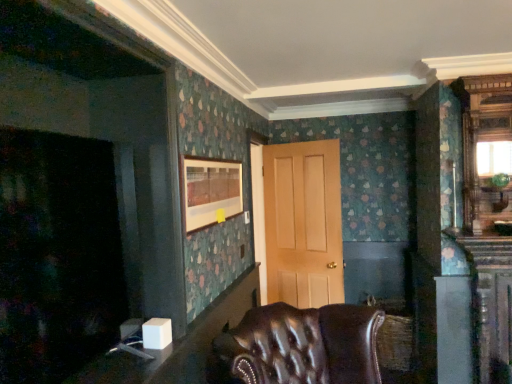
Identify the location of white glossy table at lower left, the 2th table in the bottom-to-top sequence. Image resolution: width=512 pixels, height=384 pixels. (124, 366).

Image resolution: width=512 pixels, height=384 pixels. What do you see at coordinates (298, 346) in the screenshot? I see `leather tufted chair at lower center` at bounding box center [298, 346].

Identify the location of light brown wood door at center. This screenshot has height=384, width=512. (302, 224).

In the scene shown: What is the approximate height of white plastic table at lower left, the first table from the bottom?

The height of white plastic table at lower left, the first table from the bottom, is 19.22 inches.

Find the location of a particular element. Image resolution: width=512 pixels, height=384 pixels. white glossy table at lower left, the 2th table in the bottom-to-top sequence is located at coordinates pos(124,366).

Is leather tufted chair at lower center completely or partially inside white glossy table at lower left, the 2th table in the bottom-to-top sequence?

No, leather tufted chair at lower center is not a part of white glossy table at lower left, the 2th table in the bottom-to-top sequence.

Is white glossy table at lower left, placed as the 1th table when sorted from top to bottom, facing towards leather tufted chair at lower center?

No, white glossy table at lower left, placed as the 1th table when sorted from top to bottom, is not turned towards leather tufted chair at lower center.

Is white glossy table at lower left, the 2th table in the bottom-to-top sequence, wider or thinner than leather tufted chair at lower center?

Considering their sizes, white glossy table at lower left, the 2th table in the bottom-to-top sequence, looks slimmer than leather tufted chair at lower center.

Consider the image. Is white glossy table at lower left, placed as the 1th table when sorted from top to bottom, not close to leather tufted chair at lower center?

That's not correct — white glossy table at lower left, placed as the 1th table when sorted from top to bottom, is a little close to leather tufted chair at lower center.

How many degrees apart are the facing directions of white glossy table at lower left, the 2th table in the bottom-to-top sequence, and matte wooden picture frame at upper center?

They differ by 1.11 degrees in their facing directions.

Is white glossy table at lower left, the 2th table in the bottom-to-top sequence, taller than matte wooden picture frame at upper center?

No.

From a real-world perspective, which object stands above the other?

matte wooden picture frame at upper center.

Can matte wooden picture frame at upper center be found inside white glossy table at lower left, placed as the 1th table when sorted from top to bottom?

Definitely not — matte wooden picture frame at upper center is not inside white glossy table at lower left, placed as the 1th table when sorted from top to bottom.

Which point is more forward, (233, 173) or (292, 279)?

The point (233, 173) is closer.

Is matte wooden picture frame at upper center not within light brown wood door at center?

Yes.

What's the angular difference between matte wooden picture frame at upper center and light brown wood door at center's facing directions?

Answer: 110 degrees separate the facing orientations of matte wooden picture frame at upper center and light brown wood door at center.

Looking at the image, does matte wooden picture frame at upper center seem bigger or smaller compared to light brown wood door at center?

In the image, matte wooden picture frame at upper center appears to be smaller than light brown wood door at center.

From the image's perspective, is white glossy table at lower left, the 2th table in the bottom-to-top sequence, under white plastic table at lower left, marked as the 2th table in a top-to-bottom arrangement?

No.

Could you measure the distance between white glossy table at lower left, placed as the 1th table when sorted from top to bottom, and white plastic table at lower left, the first table from the bottom?

They are 14.98 centimeters apart.

Considering the sizes of objects white glossy table at lower left, placed as the 1th table when sorted from top to bottom, and white plastic table at lower left, marked as the 2th table in a top-to-bottom arrangement, in the image provided, who is taller, white glossy table at lower left, placed as the 1th table when sorted from top to bottom, or white plastic table at lower left, marked as the 2th table in a top-to-bottom arrangement,?

white plastic table at lower left, marked as the 2th table in a top-to-bottom arrangement.

Locate an element on the screen. This screenshot has height=384, width=512. picture frame on the left of the white plastic table at lower left, the first table from the bottom is located at coordinates (210, 191).

In terms of width, does white plastic table at lower left, marked as the 2th table in a top-to-bottom arrangement, look wider or thinner when compared to matte wooden picture frame at upper center?

white plastic table at lower left, marked as the 2th table in a top-to-bottom arrangement, is wider than matte wooden picture frame at upper center.

Does point (69, 382) come closer to viewer compared to point (197, 165)?

Yes.

From a real-world perspective, which object stands above the other?

matte wooden picture frame at upper center is physically above.

Does light brown wood door at center turn towards leather tufted chair at lower center?

No, light brown wood door at center is not aimed at leather tufted chair at lower center.

Are light brown wood door at center and leather tufted chair at lower center located far from each other?

light brown wood door at center is positioned a significant distance from leather tufted chair at lower center.

From the image's perspective, is light brown wood door at center above or below leather tufted chair at lower center?

Clearly, from the image's perspective, light brown wood door at center is above leather tufted chair at lower center.

Where is `picture frame behind the leather tufted chair at lower center`? picture frame behind the leather tufted chair at lower center is located at coordinates (210, 191).

In terms of size, does matte wooden picture frame at upper center appear bigger or smaller than leather tufted chair at lower center?

Clearly, matte wooden picture frame at upper center is smaller in size than leather tufted chair at lower center.

Can you tell me how much matte wooden picture frame at upper center and leather tufted chair at lower center differ in facing direction?

40.7 degrees separate the facing orientations of matte wooden picture frame at upper center and leather tufted chair at lower center.

Can you confirm if matte wooden picture frame at upper center is wider than leather tufted chair at lower center?

Incorrect, the width of matte wooden picture frame at upper center does not surpass that of leather tufted chair at lower center.

At what (x,y) coordinates should I click in order to perform the action: click on the 1st table behind when counting from the leather tufted chair at lower center. Please return your answer as a coordinate pair (x, y). This screenshot has width=512, height=384. Looking at the image, I should click on (124, 366).

From the image's perspective, starting from the matte wooden picture frame at upper center, which table is the 1st one below? Please provide its 2D coordinates.

[(124, 366)]

When comparing their distances from light brown wood door at center, does white plastic table at lower left, marked as the 2th table in a top-to-bottom arrangement, or leather tufted chair at lower center seem further?

leather tufted chair at lower center is further to light brown wood door at center.

From the image, which object appears to be nearer to leather tufted chair at lower center, white plastic table at lower left, marked as the 2th table in a top-to-bottom arrangement, or matte wooden picture frame at upper center?

white plastic table at lower left, marked as the 2th table in a top-to-bottom arrangement, is closer to leather tufted chair at lower center.

Estimate the real-world distances between objects in this image. Which object is further from leather tufted chair at lower center, white plastic table at lower left, the first table from the bottom, or light brown wood door at center?

Based on the image, light brown wood door at center appears to be further to leather tufted chair at lower center.

Considering their positions, is white plastic table at lower left, marked as the 2th table in a top-to-bottom arrangement, positioned closer to matte wooden picture frame at upper center than leather tufted chair at lower center?

white plastic table at lower left, marked as the 2th table in a top-to-bottom arrangement, is closer to matte wooden picture frame at upper center.

From the image, which object appears to be nearer to leather tufted chair at lower center, matte wooden picture frame at upper center or white glossy table at lower left, the 2th table in the bottom-to-top sequence?

white glossy table at lower left, the 2th table in the bottom-to-top sequence, is positioned closer to the anchor leather tufted chair at lower center.

Which object lies nearer to the anchor point white glossy table at lower left, the 2th table in the bottom-to-top sequence, white plastic table at lower left, the first table from the bottom, or matte wooden picture frame at upper center?

Among the two, white plastic table at lower left, the first table from the bottom, is located nearer to white glossy table at lower left, the 2th table in the bottom-to-top sequence.

From the image, which object appears to be farther from light brown wood door at center, white glossy table at lower left, the 2th table in the bottom-to-top sequence, or white plastic table at lower left, marked as the 2th table in a top-to-bottom arrangement?

Based on the image, white glossy table at lower left, the 2th table in the bottom-to-top sequence, appears to be further to light brown wood door at center.

Estimate the real-world distances between objects in this image. Which object is further from matte wooden picture frame at upper center, white plastic table at lower left, marked as the 2th table in a top-to-bottom arrangement, or light brown wood door at center?

Based on the image, light brown wood door at center appears to be further to matte wooden picture frame at upper center.

Find the location of a particular element. picture frame between leather tufted chair at lower center and light brown wood door at center from front to back is located at coordinates pos(210,191).

Identify the location of table between white glossy table at lower left, the 2th table in the bottom-to-top sequence, and light brown wood door at center in the front-back direction. This screenshot has height=384, width=512. (177, 345).

This screenshot has width=512, height=384. Identify the location of picture frame positioned between white glossy table at lower left, the 2th table in the bottom-to-top sequence, and light brown wood door at center from near to far. (210, 191).

Where is `table located between white glossy table at lower left, the 2th table in the bottom-to-top sequence, and leather tufted chair at lower center in the left-right direction`? table located between white glossy table at lower left, the 2th table in the bottom-to-top sequence, and leather tufted chair at lower center in the left-right direction is located at coordinates (177, 345).